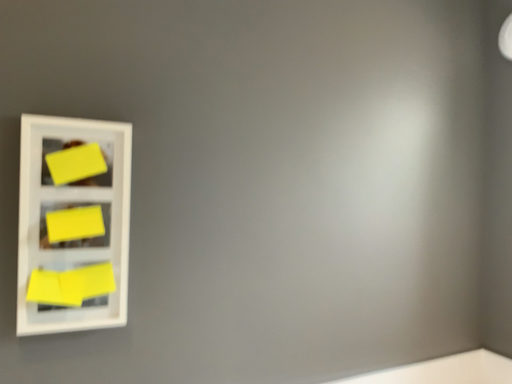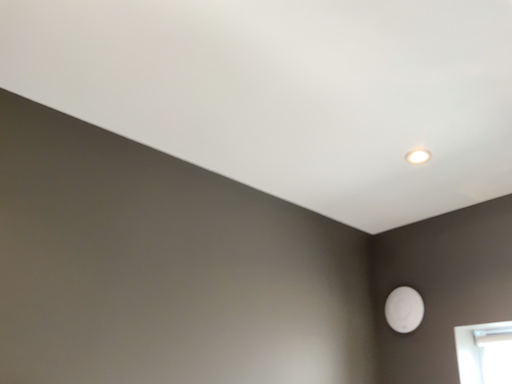
Question: How did the camera likely rotate when shooting the video?

Choices:
 (A) rotated right
 (B) rotated left

Answer: (A)